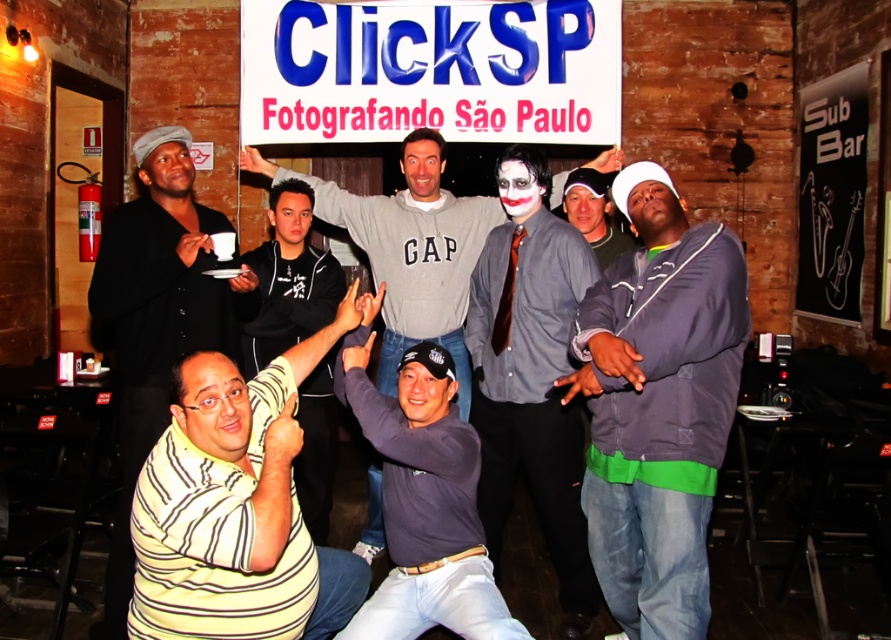
Question: Which is farther from the dark gray hoodie at right?

Choices:
 (A) white matte shirt at center
 (B) yellow striped shirt at upper left
 (C) blue plastic sign at upper center

Answer: (C)

Question: Which point is farther from the camera taking this photo?

Choices:
 (A) (405, 269)
 (B) (477, 8)

Answer: (B)

Question: From the image, what is the correct spatial relationship of dark blue jersey at center in relation to white matte shirt at center?

Choices:
 (A) above
 (B) below

Answer: (B)

Question: Can you confirm if matte gray shirt at center is bigger than white matte shirt at center?

Choices:
 (A) yes
 (B) no

Answer: (A)

Question: From the image, what is the correct spatial relationship of dark blue jersey at center in relation to white matte shirt at center?

Choices:
 (A) below
 (B) above

Answer: (A)

Question: Which point is closer to the camera?

Choices:
 (A) (501, 58)
 (B) (673, 445)
 (C) (421, 316)
 (D) (440, 390)

Answer: (B)